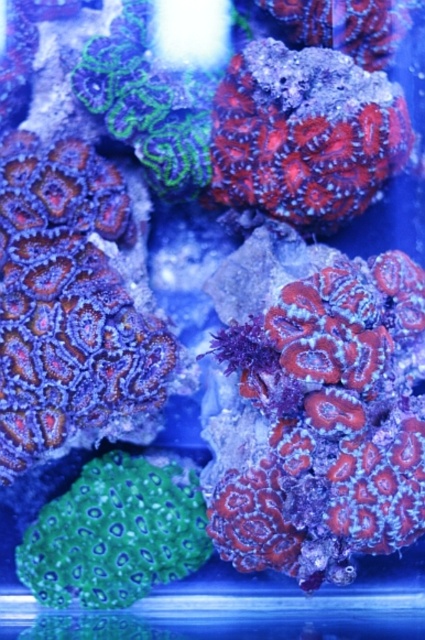
Question: Among these objects, which one is nearest to the camera?

Choices:
 (A) shiny coral at center
 (B) smooth coral at center
 (C) green textured coral at lower left

Answer: (B)

Question: Does shiny coral at center appear on the right side of green textured coral at lower left?

Choices:
 (A) no
 (B) yes

Answer: (B)

Question: Is smooth coral at center in front of shiny coral at center?

Choices:
 (A) no
 (B) yes

Answer: (B)

Question: Can you confirm if smooth coral at center is positioned to the right of shiny coral at center?

Choices:
 (A) no
 (B) yes

Answer: (B)

Question: Which object appears farthest from the camera in this image?

Choices:
 (A) green textured coral at lower left
 (B) shiny coral at center

Answer: (A)

Question: Among these objects, which one is farthest from the camera?

Choices:
 (A) green textured coral at lower left
 (B) smooth coral at center
 (C) shiny coral at center

Answer: (A)